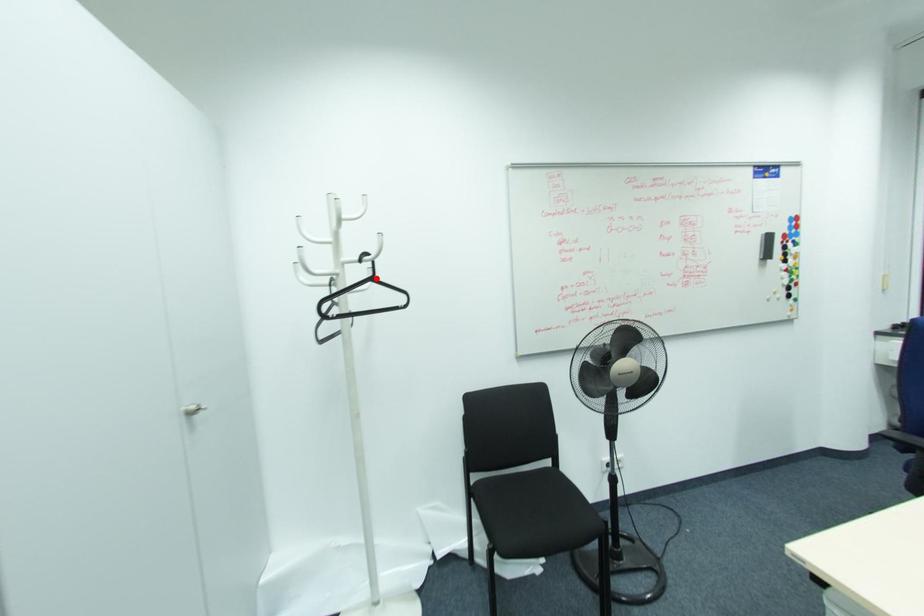
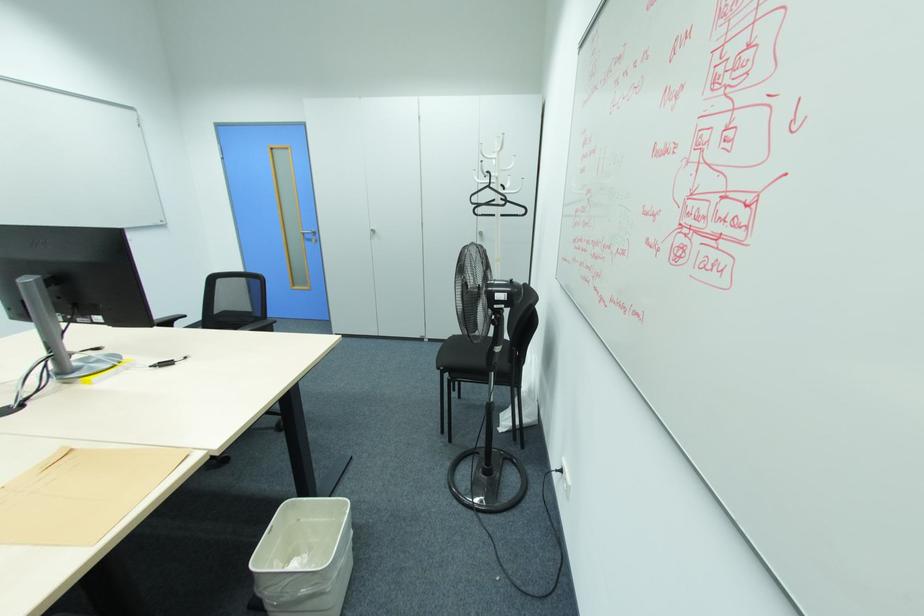
Locate, in the second image, the point that corresponds to the highlighted location in the first image.

(492, 185)